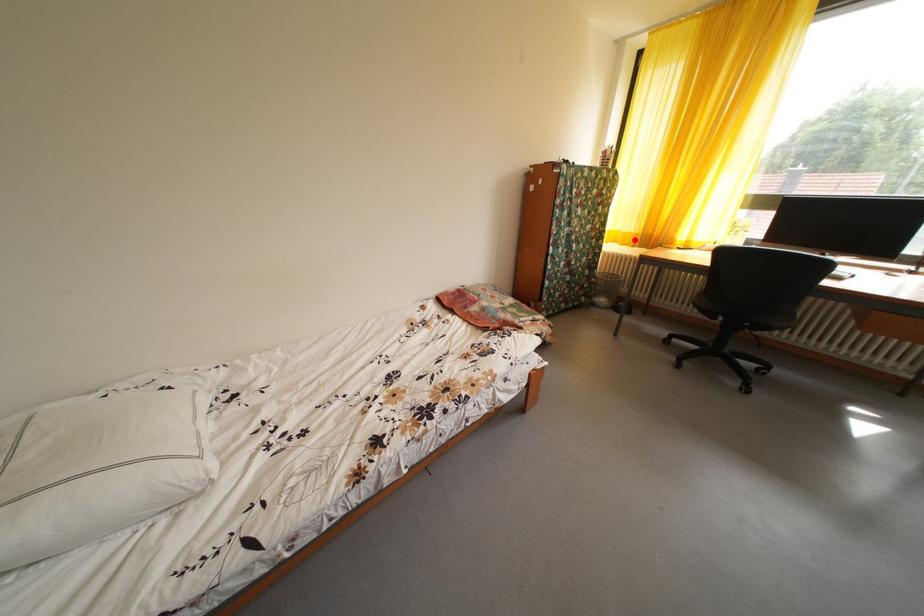
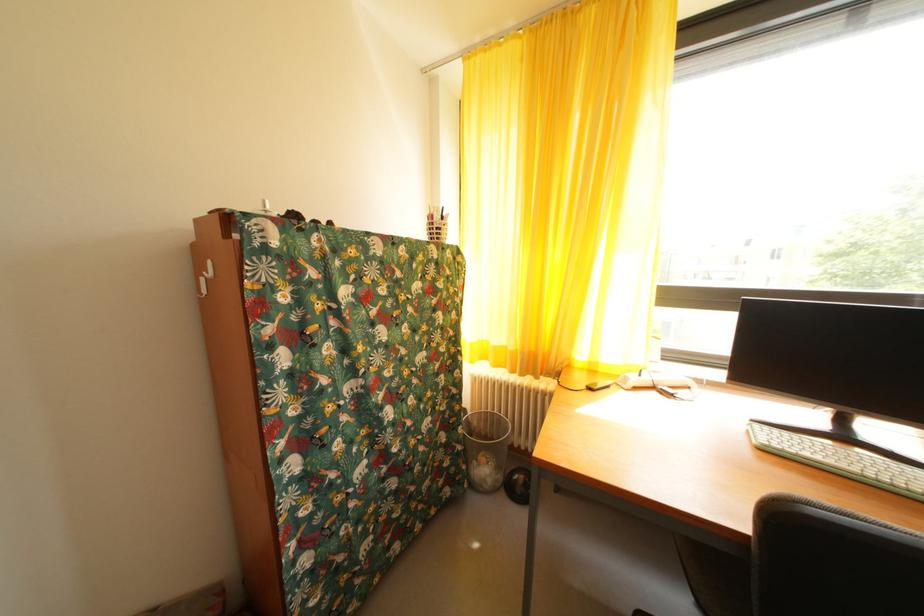
Question: I am providing you with two images of the same scene from different viewpoints. A red point is shown in image1. For the corresponding object point in image2, is it positioned nearer or farther from the camera?

Choices:
 (A) Nearer
 (B) Farther

Answer: (B)